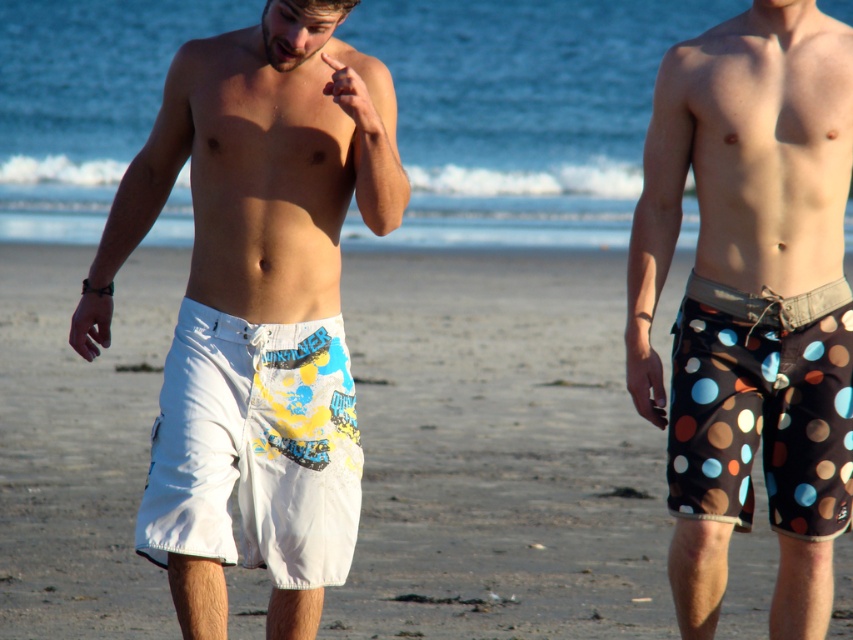
You are a photographer standing at the camera position. You want to take a photo of the white fabric shorts at center. However, there is a 7.5 meters wide obstacle between you and the shorts. Can you move around to get a clear shot without moving the shorts?

The white fabric shorts at center and camera are 7.50 meters apart from each other. Since the obstacle is 7.5 meters wide, it exactly spans the distance between you and the shorts. Therefore, you cannot move around to get a clear shot without moving the obstacle or the shorts.

Consider the image. You are a photographer taking a photo of the two men on the beach. You notice two points marked in the image. The first point is at coordinates point (517, 344) and the second is at point (236, 406). Which point is closer to the camera?

Point (517, 344) is closer to the camera because it is further to the viewer than point (236, 406).